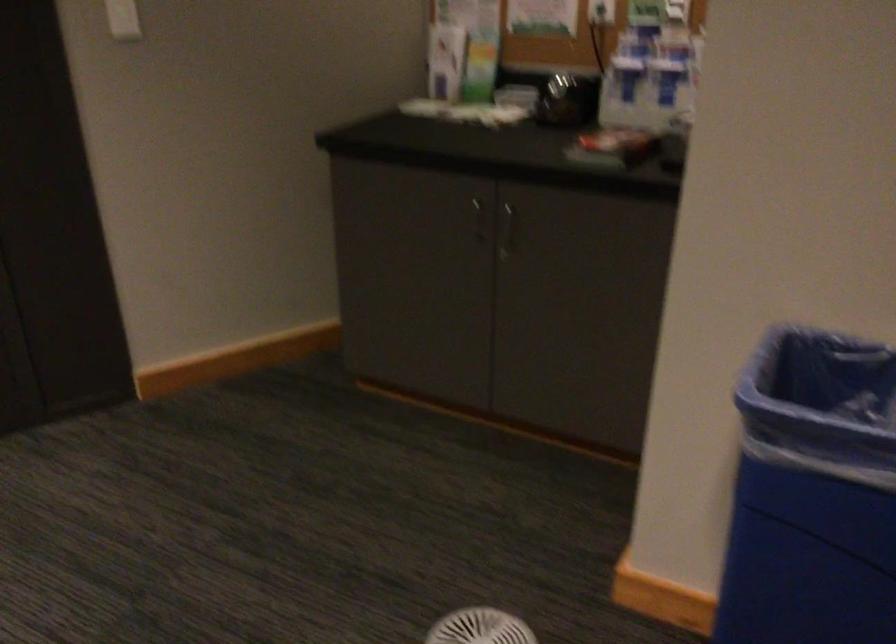
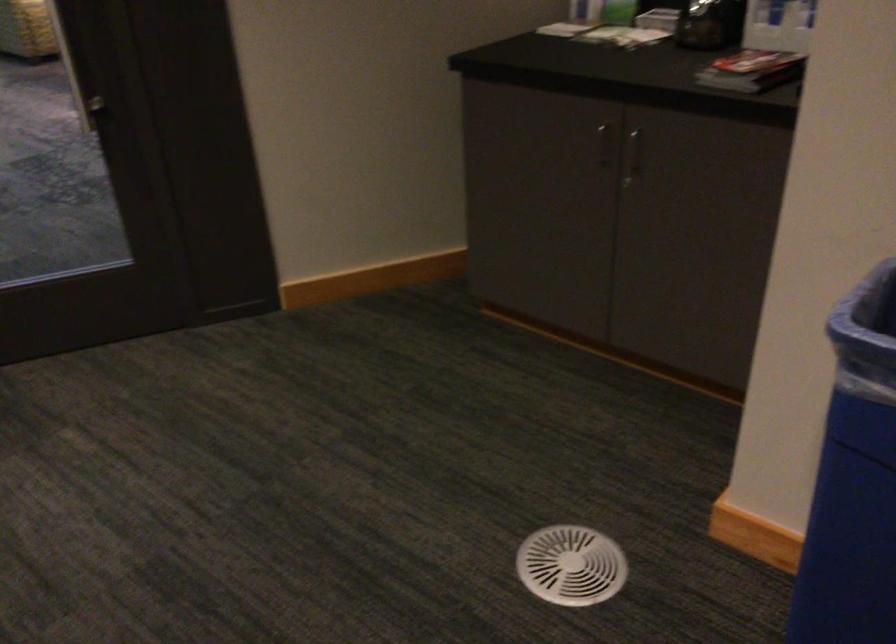
Question: In a continuous first-person perspective shot, in which direction is the camera moving?

Choices:
 (A) Left
 (B) Right
 (C) Forward
 (D) Backward

Answer: (B)